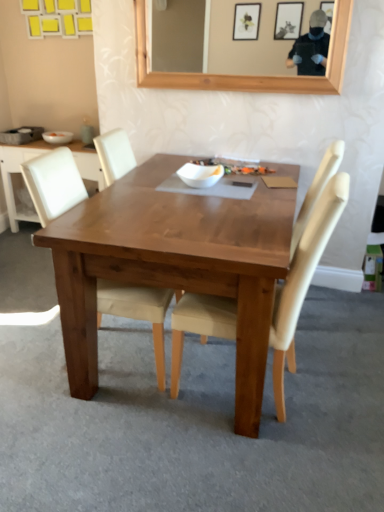
At what (x,y) coordinates should I click in order to perform the action: click on free space above wooden table at center (from a real-world perspective). Please return your answer as a coordinate pair (x, y). The height and width of the screenshot is (512, 384). Looking at the image, I should click on (x=203, y=206).